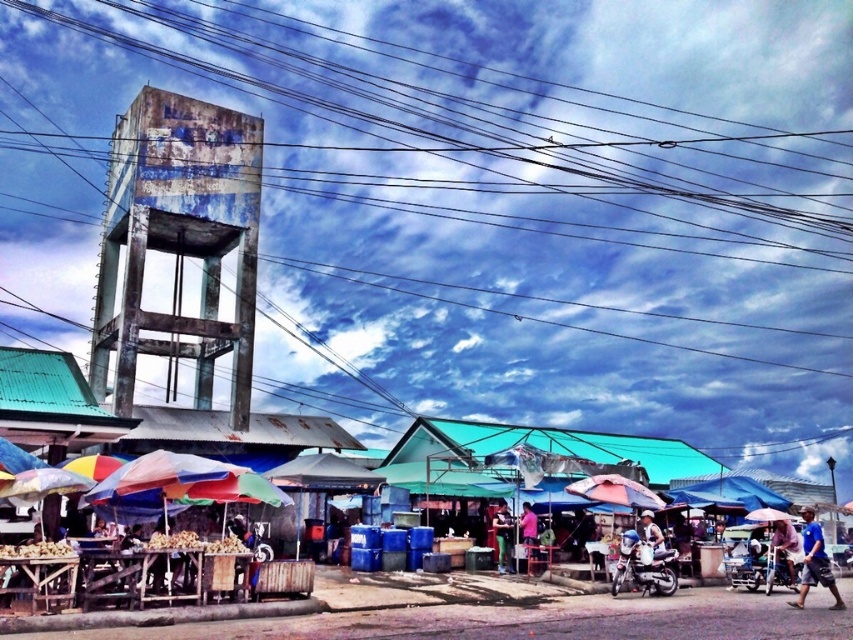
You are a customer at the market and want to sit down to rest. You see the wooden tables at lower left and the blue fabric canopy at center. Which object is closer to you, and why?

The wooden tables at lower left are closer to you because they are positioned in front of the blue fabric canopy at center, meaning they are nearer to your viewpoint.

You are standing at the point marked by coordinates (785,547) in the image. What object are you directly above?

The point marked by coordinates (785,547) is directly above the pink fabric umbrella at center.

You are a customer holding a 1.5 meter wide box and want to place it between the wooden tables at lower left and the blue fabric canopy at center. Can the box fit in the space between them?

The wooden tables at lower left and blue fabric canopy at center are 15.19 meters apart, so the 1.5 meter wide box can easily fit in the space between them since the distance is much larger than the box width.